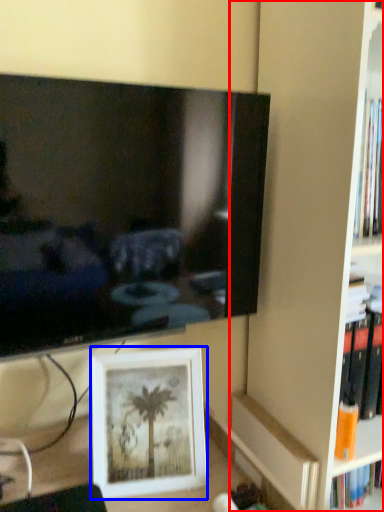
Question: Which object appears closest to the camera in this image, bookshelf (highlighted by a red box) or picture frame (highlighted by a blue box)?

Choices:
 (A) bookshelf
 (B) picture frame

Answer: (A)